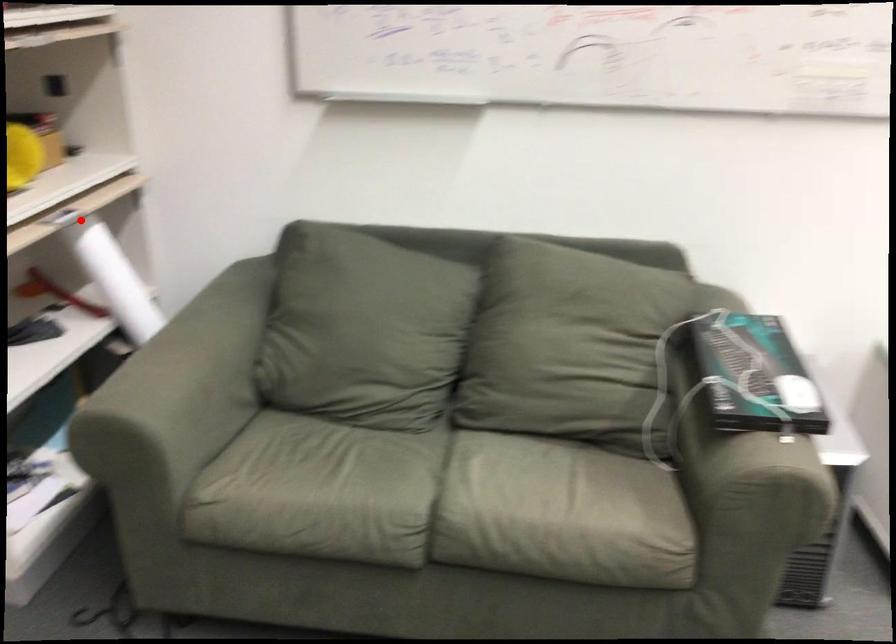
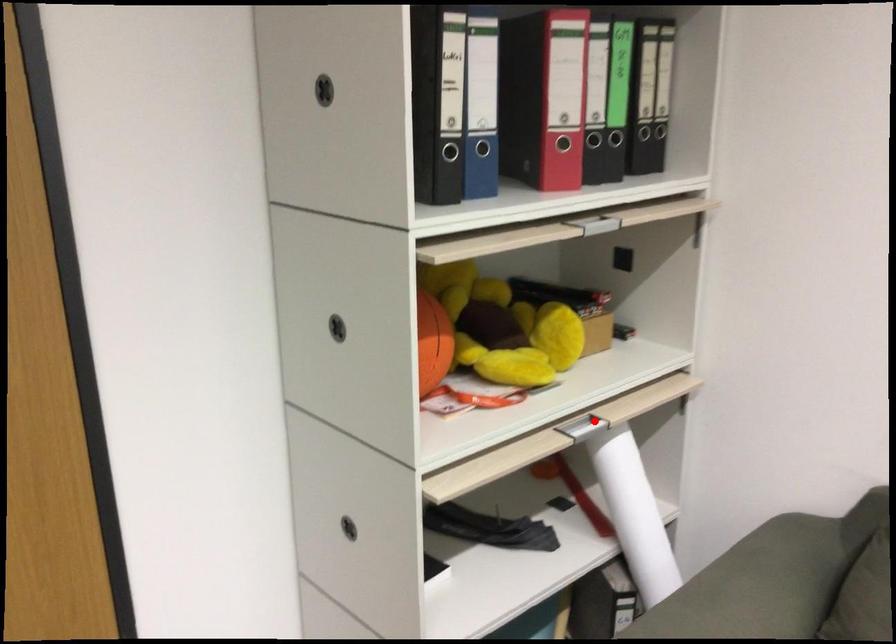
I am providing you with two images of the same scene from different viewpoints. A red point is marked on the first image and another point is marked on the second image. Is the marked point in image1 the same physical position as the marked point in image2?

Yes